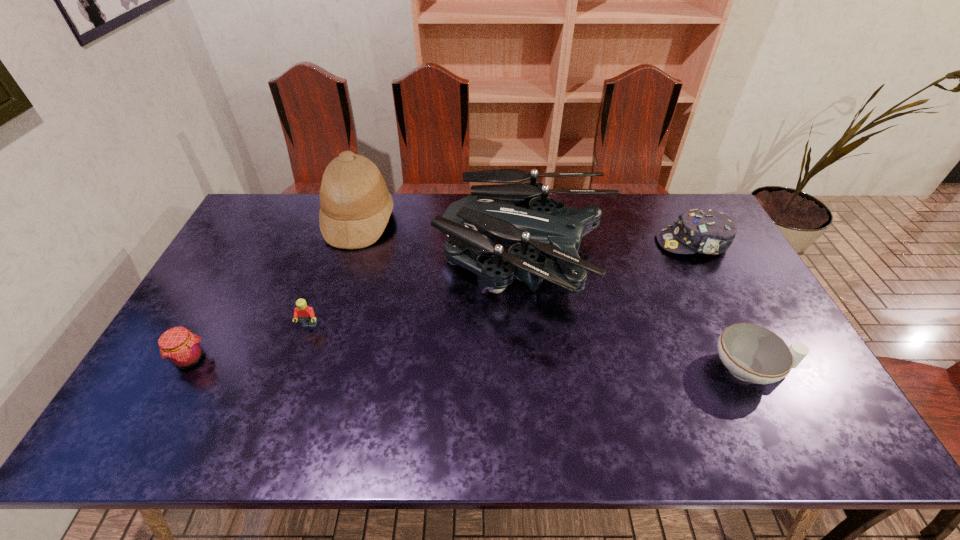
Locate an element on the screen. vacant area between the headwear and the leftmost object is located at coordinates click(x=442, y=301).

Locate an element on the screen. Image resolution: width=960 pixels, height=540 pixels. empty space that is in between the fifth shortest object and the Lego is located at coordinates (418, 295).

This screenshot has width=960, height=540. I want to click on object identified as the second closest to the Lego, so click(356, 205).

The image size is (960, 540). Identify the location of object that is the fifth closest one to the leftmost object. (705, 231).

Identify the location of vacant space that satisfies the following two spatial constraints: 1. on the front-facing side of the headwear; 2. on the face of the Lego. This screenshot has height=540, width=960. (735, 326).

Where is `free space that satisfies the following two spatial constraints: 1. on the front-facing side of the headwear; 2. on the front side of the second tallest object`? free space that satisfies the following two spatial constraints: 1. on the front-facing side of the headwear; 2. on the front side of the second tallest object is located at coordinates (704, 265).